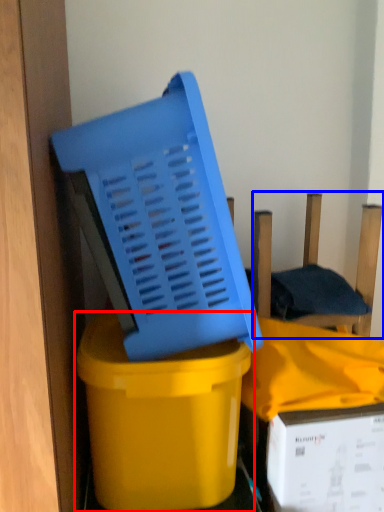
Question: Which object is further to the camera taking this photo, waste container (highlighted by a red box) or chair (highlighted by a blue box)?

Choices:
 (A) waste container
 (B) chair

Answer: (B)